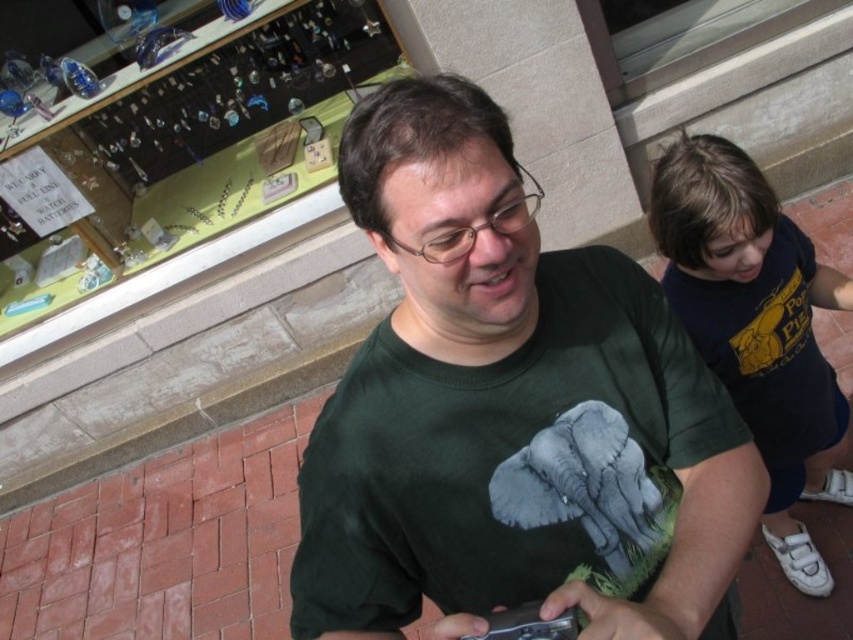
Between green matte t-shirt at center and dark blue t-shirt at upper right, which one is positioned higher?

dark blue t-shirt at upper right

Is green matte t-shirt at center below dark blue t-shirt at upper right?

Yes.

Is point (631, 360) farther from viewer compared to point (778, 362)?

That is False.

Find the location of a particular element. The image size is (853, 640). green matte t-shirt at center is located at coordinates (509, 410).